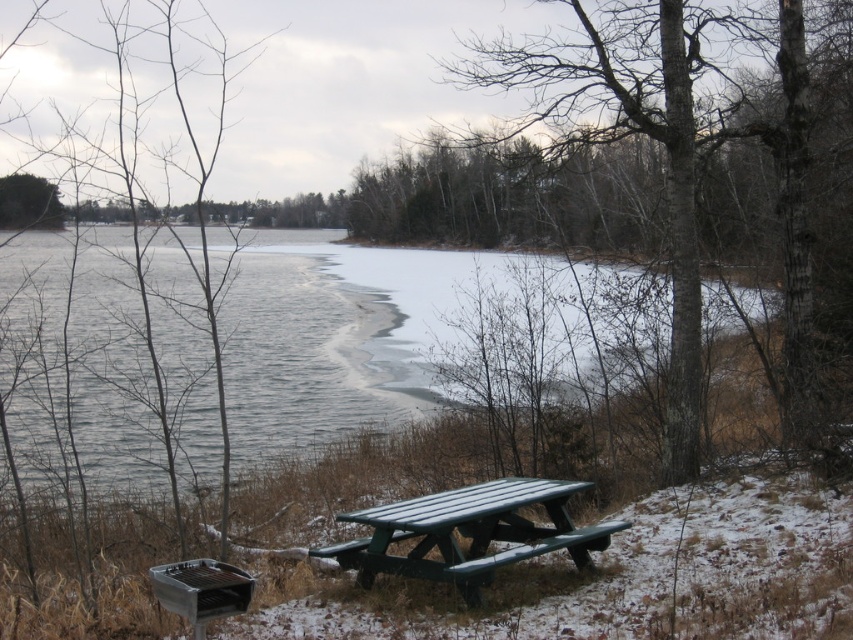
You are planning to set up a small tent between the green plastic picnic table at center and the smooth metal grill at lower left. Based on their positions, which side of the picnic table should you place the tent to avoid blocking the grill?

The green plastic picnic table at center is to the right of the smooth metal grill at lower left, so placing the tent to the left side of the picnic table would keep it away from the grill.

You are standing at the picnic table with a greenish blue finish off center to the right and see two points in the scene, point (144, 337) and point (53, 216). Which point is closer to you?

Point (144, 337) is closer to the viewer than point (53, 216).

You are planning to hang a bird feeder from a branch. The bird feeder requires a hook that can support its weight. Given the scene, which object would be more suitable for hanging the bird feeder, the smooth bark tree at center or the green plastic picnic table at center?

The smooth bark tree at center is taller than the green plastic picnic table at center, so the smooth bark tree at center would be more suitable for hanging the bird feeder as it provides a higher point for the hook.